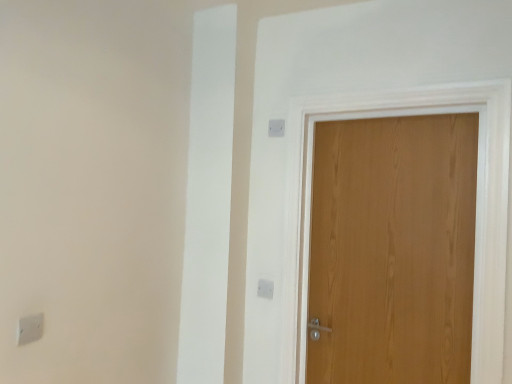
What do you see at coordinates (276, 128) in the screenshot?
I see `white plastic light switch at upper center, positioned as the second light switch in back-to-front order` at bounding box center [276, 128].

The height and width of the screenshot is (384, 512). I want to click on white plastic light switch at upper center, the third light switch in the left-to-right sequence, so click(x=276, y=128).

The width and height of the screenshot is (512, 384). What do you see at coordinates (393, 250) in the screenshot?
I see `wooden door at right` at bounding box center [393, 250].

The width and height of the screenshot is (512, 384). In order to click on white plastic light switch at lower left, the 3th light switch from the right in this screenshot , I will do `click(30, 328)`.

Is white plastic light switch at upper center, positioned as the 1th light switch in bottom-to-top order, directly adjacent to white plastic light switch at lower left, which is the 2th light switch from top to bottom?

No, white plastic light switch at upper center, positioned as the 1th light switch in bottom-to-top order, is not beside white plastic light switch at lower left, which is the 2th light switch from top to bottom.

What's the angular difference between white plastic light switch at upper center, which is counted as the 3th light switch, starting from the top, and white plastic light switch at lower left, the 3th light switch from the right,'s facing directions?

89 degrees separate the facing orientations of white plastic light switch at upper center, which is counted as the 3th light switch, starting from the top, and white plastic light switch at lower left, the 3th light switch from the right.

Can white plastic light switch at lower left, the 3th light switch from the right, be found inside white plastic light switch at upper center, the 3th light switch viewed from the front?

No, white plastic light switch at lower left, the 3th light switch from the right, is not inside white plastic light switch at upper center, the 3th light switch viewed from the front.

Between white plastic light switch at upper center, the 3th light switch viewed from the front, and white plastic light switch at lower left, which is counted as the 3th light switch, starting from the back, which one appears on the left side from the viewer's perspective?

From the viewer's perspective, white plastic light switch at lower left, which is counted as the 3th light switch, starting from the back, appears more on the left side.

Between white plastic light switch at upper center, the 1th light switch from the back, and wooden door at right, which one has larger width?

With larger width is wooden door at right.

Is white plastic light switch at upper center, which is counted as the 3th light switch, starting from the top, not close to wooden door at right?

white plastic light switch at upper center, which is counted as the 3th light switch, starting from the top, is actually quite close to wooden door at right.

From the picture: Is white plastic light switch at upper center, the 1th light switch from the back, turned away from wooden door at right?

No, wooden door at right is not at the back of white plastic light switch at upper center, the 1th light switch from the back.

Does point (260, 287) appear closer or farther from the camera than point (334, 317)?

Point (260, 287).

Could you tell me if white plastic light switch at upper center, positioned as the second light switch in back-to-front order, is turned towards white plastic light switch at upper center, the 1th light switch from the back?

No, white plastic light switch at upper center, positioned as the second light switch in back-to-front order, is not turned towards white plastic light switch at upper center, the 1th light switch from the back.

From the white plastic light switch at upper center, the 1th light switch from the back, count 1st light switchs forward and point to it. Please provide its 2D coordinates.

[(276, 128)]

Do you think white plastic light switch at upper center, which is counted as the 1th light switch, starting from the right, is within white plastic light switch at upper center, which is counted as the 3th light switch, starting from the top, or outside of it?

Answer: white plastic light switch at upper center, which is counted as the 1th light switch, starting from the right, is located beyond the bounds of white plastic light switch at upper center, which is counted as the 3th light switch, starting from the top.

Considering the relative sizes of white plastic light switch at upper center, the third light switch in the left-to-right sequence, and white plastic light switch at upper center, the second light switch in the right-to-left sequence, in the image provided, is white plastic light switch at upper center, the third light switch in the left-to-right sequence, wider than white plastic light switch at upper center, the second light switch in the right-to-left sequence,?

No.

Is wooden door at right outside of white plastic light switch at upper center, which ranks as the 2th light switch in front-to-back order?

wooden door at right is positioned outside white plastic light switch at upper center, which ranks as the 2th light switch in front-to-back order.

Visually, is wooden door at right positioned to the left or to the right of white plastic light switch at upper center, the third light switch in the left-to-right sequence?

wooden door at right is positioned on white plastic light switch at upper center, the third light switch in the left-to-right sequence,'s right side.

Is point (458, 352) farther from viewer compared to point (277, 121)?

No, (458, 352) is closer to viewer.

Considering the sizes of wooden door at right and white plastic light switch at upper center, which is counted as the 1th light switch, starting from the right, in the image, is wooden door at right wider or thinner than white plastic light switch at upper center, which is counted as the 1th light switch, starting from the right,?

In the image, wooden door at right appears to be wider than white plastic light switch at upper center, which is counted as the 1th light switch, starting from the right.

Does wooden door at right have a smaller size compared to white plastic light switch at lower left, the 3th light switch from the right?

Incorrect, wooden door at right is not smaller in size than white plastic light switch at lower left, the 3th light switch from the right.

Is point (355, 261) less distant than point (36, 331)?

That is False.

From the image's perspective, which is above, wooden door at right or white plastic light switch at lower left, marked as the 2th light switch in a bottom-to-top arrangement?

wooden door at right is shown above in the image.

Considering the positions of objects wooden door at right and white plastic light switch at lower left, which is counted as the 3th light switch, starting from the back, in the image provided, who is more to the left, wooden door at right or white plastic light switch at lower left, which is counted as the 3th light switch, starting from the back,?

white plastic light switch at lower left, which is counted as the 3th light switch, starting from the back, is more to the left.

From a real-world perspective, between white plastic light switch at upper center, which is the 2th light switch in left-to-right order, and white plastic light switch at upper center, which appears as the third light switch when ordered from the bottom, who is vertically higher?

From a 3D spatial view, white plastic light switch at upper center, which appears as the third light switch when ordered from the bottom, is above.

Would you consider white plastic light switch at upper center, which is counted as the 3th light switch, starting from the top, to be distant from white plastic light switch at upper center, which appears as the third light switch when ordered from the bottom?

white plastic light switch at upper center, which is counted as the 3th light switch, starting from the top, is actually quite close to white plastic light switch at upper center, which appears as the third light switch when ordered from the bottom.

You are a GUI agent. You are given a task and a screenshot of the screen. Output one action in this format:
    pyautogui.click(x=<x>, y=<y>)
    Task: Click on the 2nd light switch above the white plastic light switch at upper center, the 1th light switch from the back (from the image's perspective)
    This screenshot has height=384, width=512.
    Given the screenshot: What is the action you would take?
    pyautogui.click(x=276, y=128)

Can you confirm if white plastic light switch at upper center, the 1th light switch from the back, is taller than white plastic light switch at upper center, which appears as the third light switch when ordered from the bottom?

Yes.

Consider the image. How far apart are white plastic light switch at upper center, positioned as the second light switch in back-to-front order, and white plastic light switch at lower left, which is the 2th light switch from top to bottom?

They are 1.29 meters apart.

Is white plastic light switch at upper center, positioned as the second light switch in back-to-front order, thinner than white plastic light switch at lower left, which is counted as the first light switch, starting from the left?

Correct, the width of white plastic light switch at upper center, positioned as the second light switch in back-to-front order, is less than that of white plastic light switch at lower left, which is counted as the first light switch, starting from the left.

In the scene shown: Can we say white plastic light switch at upper center, the third light switch in the left-to-right sequence, lies outside white plastic light switch at lower left, which is the 2th light switch from top to bottom?

Absolutely, white plastic light switch at upper center, the third light switch in the left-to-right sequence, is external to white plastic light switch at lower left, which is the 2th light switch from top to bottom.

Can you confirm if white plastic light switch at upper center, which ranks as the 2th light switch in front-to-back order, is bigger than white plastic light switch at lower left, which is counted as the first light switch, starting from the left?

No, white plastic light switch at upper center, which ranks as the 2th light switch in front-to-back order, is not bigger than white plastic light switch at lower left, which is counted as the first light switch, starting from the left.

The height and width of the screenshot is (384, 512). In order to click on light switch on the left of white plastic light switch at upper center, positioned as the 1th light switch in bottom-to-top order in this screenshot , I will do `click(30, 328)`.

At what (x,y) coordinates should I click in order to perform the action: click on door above the white plastic light switch at upper center, the second light switch in the right-to-left sequence (from the image's perspective). Please return your answer as a coordinate pair (x, y). Looking at the image, I should click on (393, 250).

From the image, which object appears to be nearer to white plastic light switch at upper center, positioned as the second light switch in back-to-front order, white plastic light switch at lower left, which is counted as the 3th light switch, starting from the back, or wooden door at right?

wooden door at right.

Considering their positions, is wooden door at right positioned further to white plastic light switch at lower left, which is the 2th light switch from top to bottom, than white plastic light switch at upper center, which is counted as the 3th light switch, starting from the top?

wooden door at right.

Looking at the image, which one is located closer to wooden door at right, white plastic light switch at upper center, positioned as the second light switch in back-to-front order, or white plastic light switch at upper center, positioned as the 1th light switch in bottom-to-top order?

white plastic light switch at upper center, positioned as the 1th light switch in bottom-to-top order.

Consider the image. Considering their positions, is wooden door at right positioned closer to white plastic light switch at upper center, positioned as the 1th light switch in top-to-bottom order, than white plastic light switch at lower left, the 3th light switch from the right?

Among the two, wooden door at right is located nearer to white plastic light switch at upper center, positioned as the 1th light switch in top-to-bottom order.

Which object lies nearer to the anchor point white plastic light switch at upper center, which ranks as the 2th light switch in front-to-back order, white plastic light switch at upper center, positioned as the 1th light switch in bottom-to-top order, or white plastic light switch at lower left, which is the 2th light switch from top to bottom?

The object closer to white plastic light switch at upper center, which ranks as the 2th light switch in front-to-back order, is white plastic light switch at upper center, positioned as the 1th light switch in bottom-to-top order.

Considering their positions, is white plastic light switch at upper center, which is counted as the 1th light switch, starting from the right, positioned closer to white plastic light switch at lower left, marked as the 2th light switch in a bottom-to-top arrangement, than wooden door at right?

Based on the image, white plastic light switch at upper center, which is counted as the 1th light switch, starting from the right, appears to be nearer to white plastic light switch at lower left, marked as the 2th light switch in a bottom-to-top arrangement.

Estimate the real-world distances between objects in this image. Which object is closer to white plastic light switch at upper center, the 1th light switch from the back, white plastic light switch at lower left, the first light switch when ordered from front to back, or white plastic light switch at upper center, the third light switch in the left-to-right sequence?

The object closer to white plastic light switch at upper center, the 1th light switch from the back, is white plastic light switch at upper center, the third light switch in the left-to-right sequence.

From the image, which object appears to be nearer to wooden door at right, white plastic light switch at upper center, the second light switch in the right-to-left sequence, or white plastic light switch at lower left, which is counted as the 3th light switch, starting from the back?

The object closer to wooden door at right is white plastic light switch at upper center, the second light switch in the right-to-left sequence.

Locate an element on the screen. The width and height of the screenshot is (512, 384). light switch between white plastic light switch at lower left, the 3th light switch from the right, and white plastic light switch at upper center, which is counted as the 1th light switch, starting from the right is located at coordinates (265, 288).

Find the location of `door between white plastic light switch at upper center, which appears as the third light switch when ordered from the bottom, and white plastic light switch at upper center, positioned as the 1th light switch in bottom-to-top order, in the up-down direction`. door between white plastic light switch at upper center, which appears as the third light switch when ordered from the bottom, and white plastic light switch at upper center, positioned as the 1th light switch in bottom-to-top order, in the up-down direction is located at coordinates (393, 250).